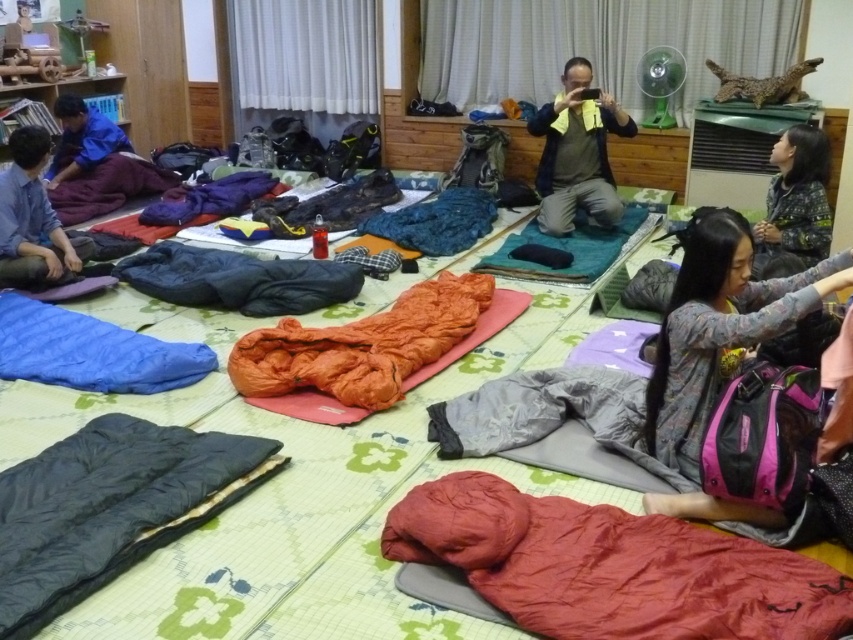
You are standing in the room with the sleeping bags and people. You want to place a small item exactly halfway between the two points marked as point (691,244) and point (538,186). Will the item be closer to the camera or farther away from it compared to the midpoint between these two points?

The midpoint between point (691,244) and point (538,186) would be equidistant from both points. However, since point (691,244) is closer to the camera than point (538,186), the midpoint will be positioned such that it is closer to the camera than the farther point but not necessarily closer or farther overall. However, the question asks if the item placed at the midpoint is closer or farther from the camera compared to the midpoint itself, which is a bit confusing. Wait, perhaps the question is,

You are organizing a group photo and want to ensure everyone is visible. The orange fabric sleeping bag at center and the patterned fabric jacket at right are both in the frame. Which object is closer to the camera?

The orange fabric sleeping bag at center is closer to the camera because it is in front of the patterned fabric jacket at right.

You are standing in the room with tatami mats and want to find the orange fabric sleeping bag at center. If you face the direction where the camera or phone is pointing, which direction should you turn to locate it?

The orange fabric sleeping bag at center is located at point coordinates of (363, 346). Since the camera or phone is being held by the person in the center, facing the direction it points would require turning towards the center of the room where the sleeping bag is placed.